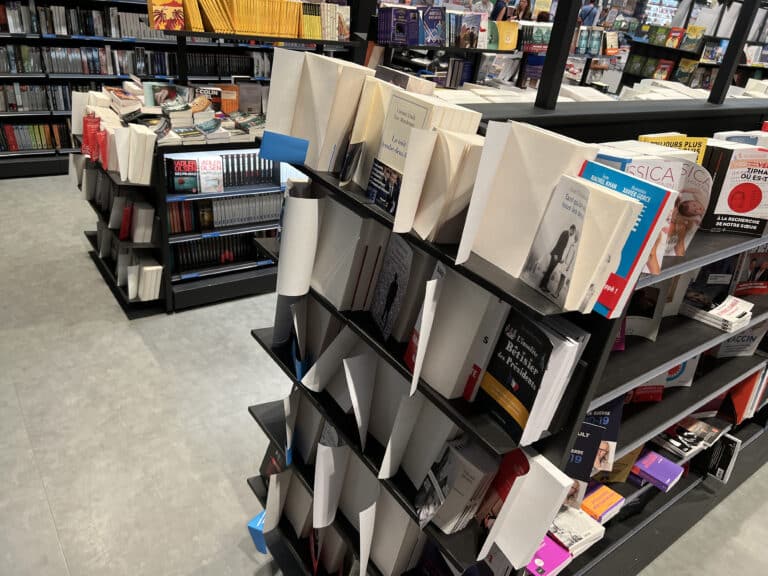
Where is `pink book`? This screenshot has height=576, width=768. pink book is located at coordinates (558, 550).